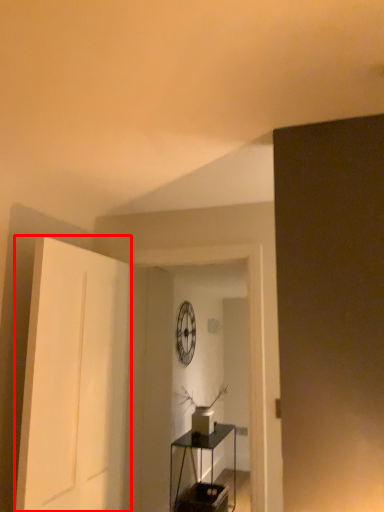
Question: Considering the relative positions of door (annotated by the red box) and table in the image provided, where is door (annotated by the red box) located with respect to the staircase?

Choices:
 (A) left
 (B) right

Answer: (A)